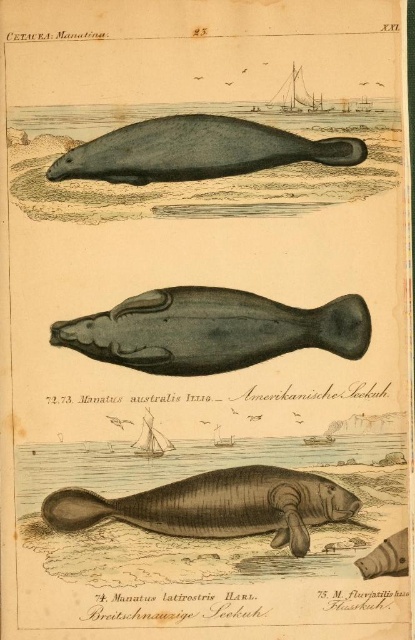
Question: Is brown textured seal at center thinner than gray matte seal at upper center?

Choices:
 (A) no
 (B) yes

Answer: (B)

Question: Among these objects, which one is farthest from the camera?

Choices:
 (A) gray matte seal at upper center
 (B) dark gray matte whale at center

Answer: (B)

Question: Which is nearer to the smooth gray seal at lower right?

Choices:
 (A) dark gray matte whale at center
 (B) gray matte seal at upper center

Answer: (A)

Question: Which of the following is the farthest from the observer?

Choices:
 (A) (112, 140)
 (B) (217, 532)
 (C) (116, 317)

Answer: (C)

Question: Can you confirm if brown textured seal at center is smaller than smooth gray seal at lower right?

Choices:
 (A) yes
 (B) no

Answer: (B)

Question: Is brown textured seal at center wider than gray matte seal at upper center?

Choices:
 (A) yes
 (B) no

Answer: (B)